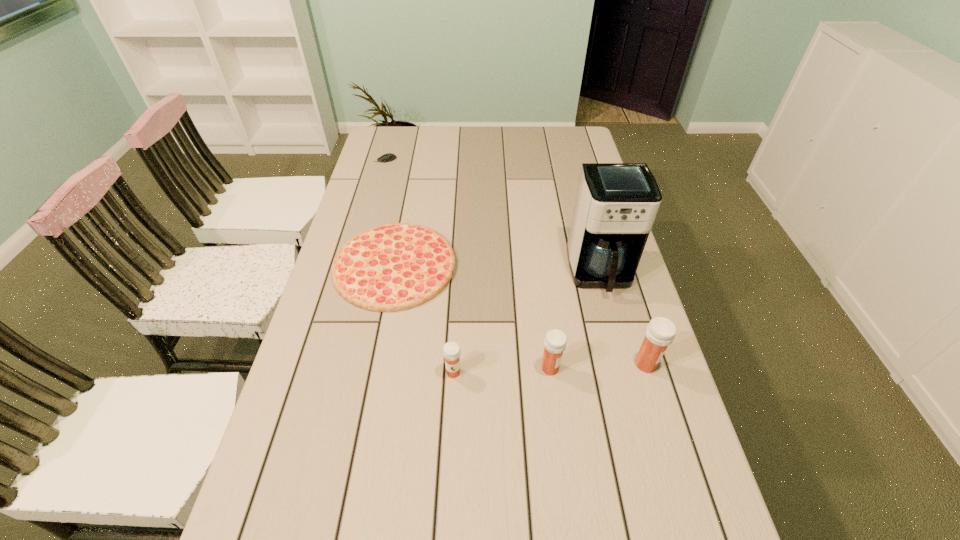
Locate an element on the screen. Image resolution: width=960 pixels, height=540 pixels. vacant area that lies between the fifth shortest object and the tallest object is located at coordinates (623, 319).

Locate an element on the screen. The width and height of the screenshot is (960, 540). vacant point located between the third shortest object and the pizza is located at coordinates (424, 319).

Where is `empty space between the tallest medicine and the pizza`? empty space between the tallest medicine and the pizza is located at coordinates (520, 315).

Where is `vacant space that's between the pizza and the third shortest object`? The height and width of the screenshot is (540, 960). vacant space that's between the pizza and the third shortest object is located at coordinates (424, 319).

Identify the location of the fourth closest object to the computer mouse. This screenshot has width=960, height=540. (555, 341).

Where is `object that is the fifth closest one to the second medicine from right to left`? object that is the fifth closest one to the second medicine from right to left is located at coordinates (388, 157).

Identify which medicine is located as the third nearest to the farthest object. Please provide its 2D coordinates. Your answer should be formatted as a tuple, i.e. [(x, y)], where the tuple contains the x and y coordinates of a point satisfying the conditions above.

[(660, 332)]

Image resolution: width=960 pixels, height=540 pixels. What are the coordinates of `medicine that stands as the closest to the shortest medicine` in the screenshot? It's located at (555, 341).

Where is `free space that satisfies the following two spatial constraints: 1. on the front panel of the coffee maker; 2. on the label side of the fourth shortest object`? free space that satisfies the following two spatial constraints: 1. on the front panel of the coffee maker; 2. on the label side of the fourth shortest object is located at coordinates (625, 368).

Identify the location of free region that satisfies the following two spatial constraints: 1. on the front panel of the coffee maker; 2. on the label side of the second shortest medicine. (625, 368).